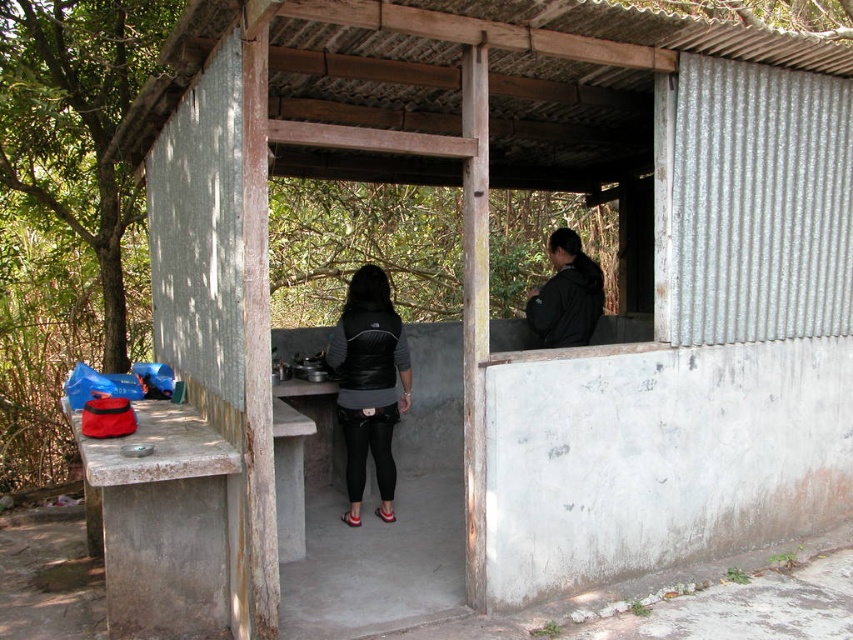
In the scene shown: You are designing a storage system for the shelter and need to place a large box that requires 1.2 meters of space. You see the black matte vest at center and the black matte jacket at upper right. Which object has enough space around it to accommodate the box?

The black matte vest at center is bigger than the black matte jacket at upper right, so the black matte vest at center likely has enough space to accommodate the box.

You are standing in front of the structure and want to know which of the two black items, the black matte vest at center or the black matte jacket at upper right, is taller. Can you determine this based on their positions?

The black matte vest at center is much taller than the black matte jacket at upper right.

You are standing at the entrance of the structure and need to pass through the narrow corridor between the black matte vest at center and the black matte jacket at upper right. The corridor is only 3 feet wide. Can you fit through the space between them?

The distance between the black matte vest at center and the black matte jacket at upper right is 4.11 feet, which is wider than the 3 feet corridor width. Therefore, you can fit through the space between them.